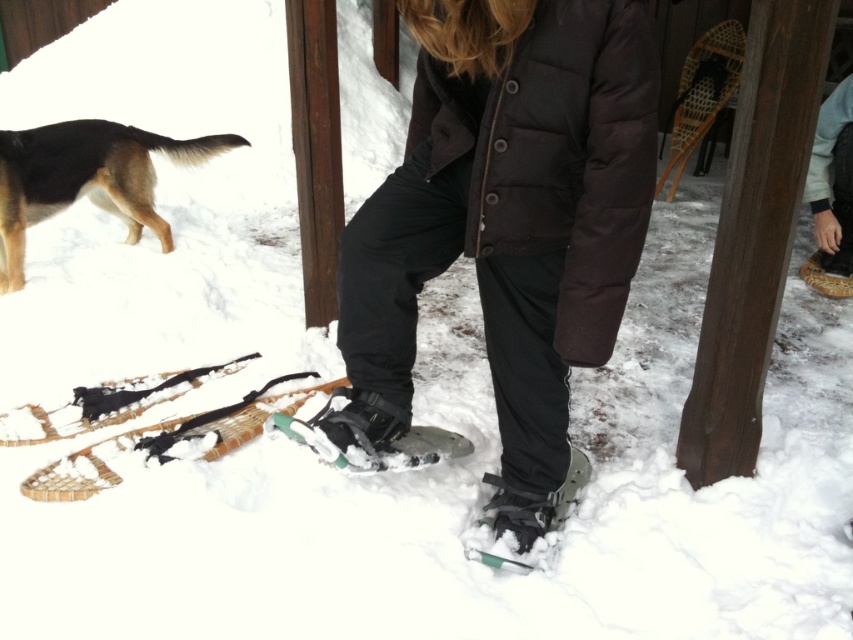
Question: Considering the relative positions of matte black snowshoes at center and brown fur dog at upper left in the image provided, where is matte black snowshoes at center located with respect to brown fur dog at upper left?

Choices:
 (A) below
 (B) above

Answer: (A)

Question: Does brown fur dog at upper left have a greater width compared to green rubber snowshoe at center?

Choices:
 (A) yes
 (B) no

Answer: (A)

Question: Which object is farther from the camera taking this photo?

Choices:
 (A) green rubber snowshoe at lower center
 (B) brown fur dog at upper left

Answer: (B)

Question: Which point is farther to the camera?

Choices:
 (A) (428, 442)
 (B) (479, 68)
 (C) (129, 237)
 (D) (827, 209)

Answer: (C)

Question: Which object appears farthest from the camera in this image?

Choices:
 (A) matte black snowshoes at center
 (B) brown fur dog at upper left
 (C) green rubber snowshoe at lower center
 (D) green rubber snowshoe at center

Answer: (B)

Question: Can you confirm if gray fleece jacket at upper right is smaller than green rubber snowshoe at lower center?

Choices:
 (A) no
 (B) yes

Answer: (A)